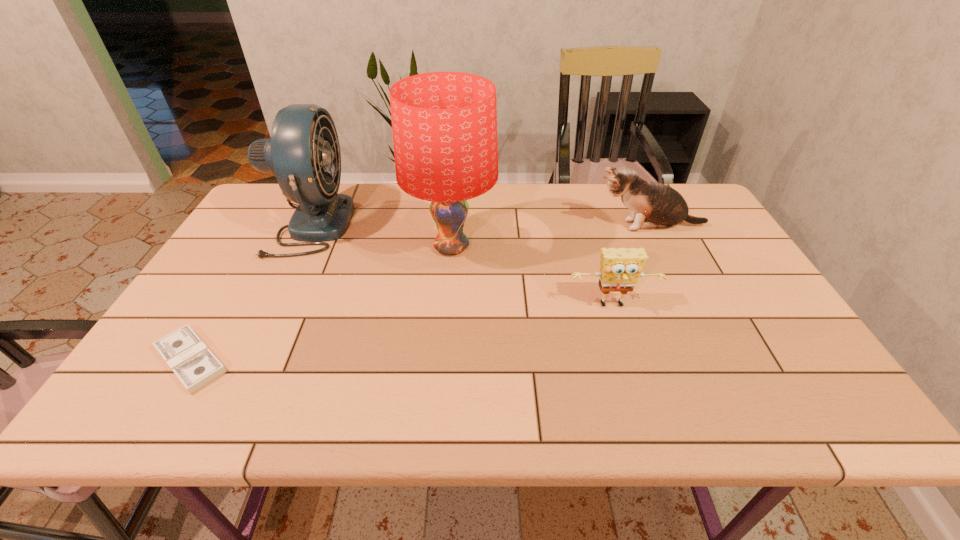
Identify the location of free space between the sponge and the nearest object. (402, 333).

Where is `the closest object relative to the third object from right to left`? This screenshot has width=960, height=540. the closest object relative to the third object from right to left is located at coordinates (621, 268).

Find the location of a particular element. The image size is (960, 540). object that is the closest one to the shortest object is located at coordinates (303, 152).

Identify the location of free region that satisfies the following two spatial constraints: 1. at the face of the cat; 2. on the face of the second nearest object. This screenshot has width=960, height=540. pyautogui.click(x=687, y=306).

At what (x,y) coordinates should I click in order to perform the action: click on free space that satisfies the following two spatial constraints: 1. at the face of the third tallest object; 2. on the face of the fourth farthest object. Please return your answer as a coordinate pair (x, y). This screenshot has width=960, height=540. Looking at the image, I should click on (687, 306).